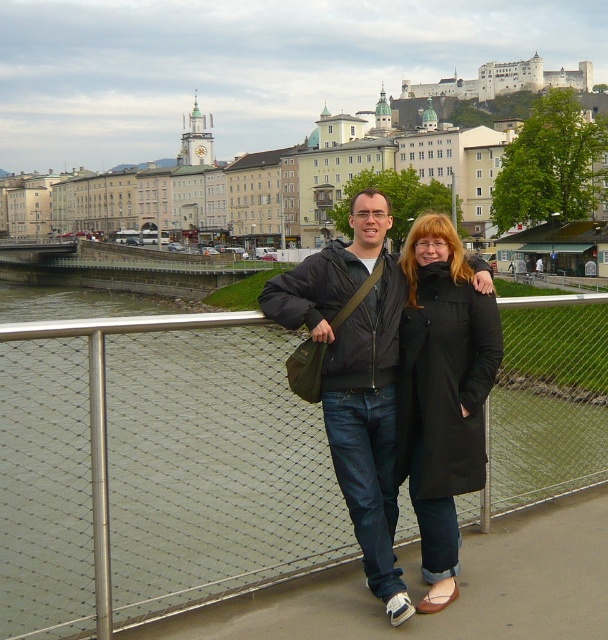
You are a photographer setting up a shot of the two people on the bridge. You notice the metal mesh fence at center and the black matte jacket at center. Which object is shorter in height?

The metal mesh fence at center is shorter in height compared to the black matte jacket at center according to the description.

Consider the image. You are standing on the bridge and want to take a photo of the two points mentioned. Which point is closer to you, point (567, 372) or point (449, 236)?

Point (449, 236) is closer to you because it is in front of point (567, 372), which is behind it according to the description.